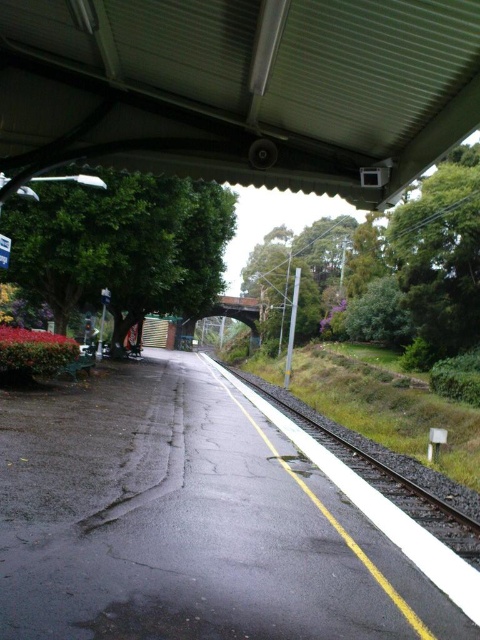
Based on the photo, is green corrugated metal canopy at upper center bigger than black asphalt train track at lower right?

No, green corrugated metal canopy at upper center is not bigger than black asphalt train track at lower right.

Which is more to the right, green corrugated metal canopy at upper center or black asphalt train track at lower right?

From the viewer's perspective, black asphalt train track at lower right appears more on the right side.

Is point (300, 125) positioned behind point (350, 452)?

No, (300, 125) is in front of (350, 452).

Locate an element on the screen. green corrugated metal canopy at upper center is located at coordinates (x=240, y=88).